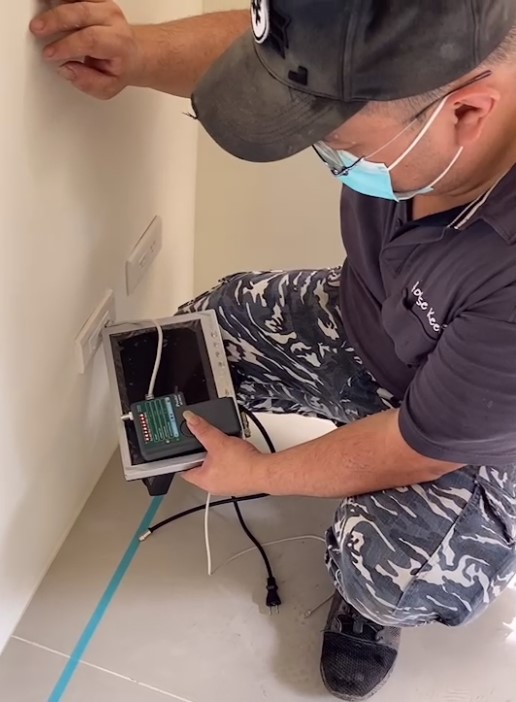
Identify the location of blue line on floor. (85, 641).